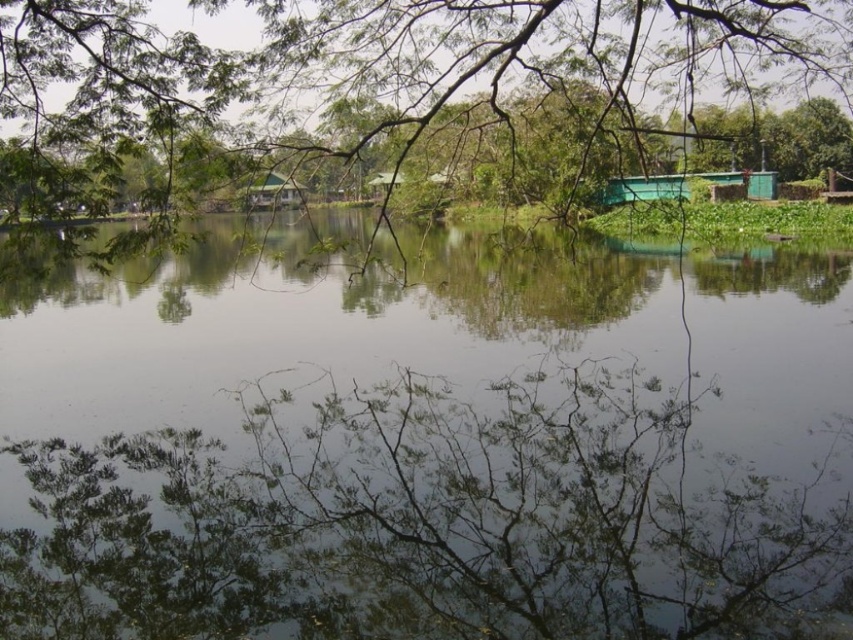
You are standing at the edge of the lake and want to find the green reflective water at center. According to the coordinates provided, where exactly should you look to locate it?

The green reflective water at center is located at point 0.697 on the x axis and 0.504 on the y axis. So you should look towards the center of the image, slightly to the right and middle area to find it.

You are an artist trying to paint the scene. You want to ensure the green reflective water at center and the green leafy tree at upper center are proportionally accurate. Which object should you paint smaller?

The green reflective water at center should be painted smaller than the green leafy tree at upper center because the description states that the green reflective water at center has a smaller size compared to green leafy tree at upper center.